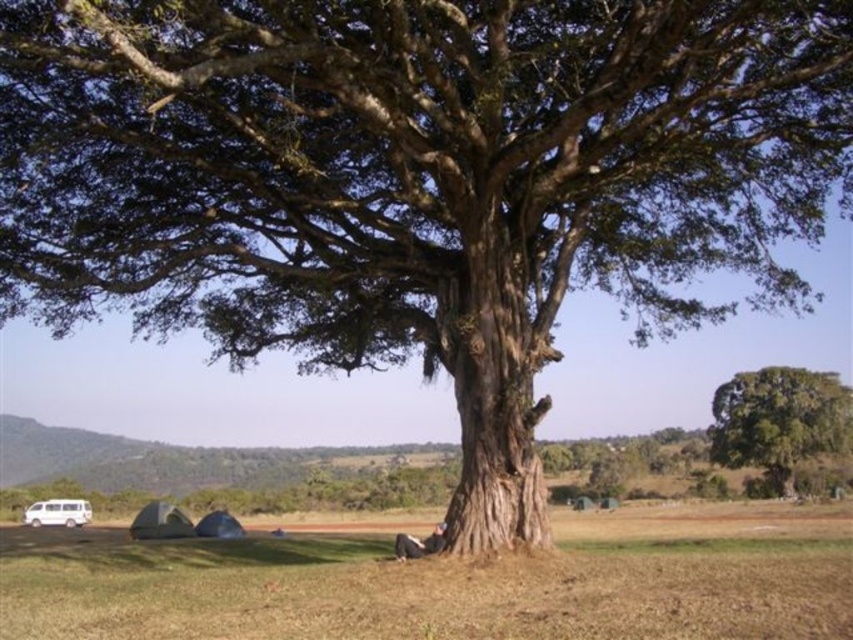
Question: Which point is closer to the camera?

Choices:
 (A) (729, 445)
 (B) (677, 522)
 (C) (51, 500)

Answer: (B)

Question: Is brown grass at lower center positioned before green rough bark tree at upper right?

Choices:
 (A) yes
 (B) no

Answer: (A)

Question: Which of the following is the closest to the observer?

Choices:
 (A) (51, 509)
 (B) (746, 413)
 (C) (601, 560)

Answer: (C)

Question: Based on their relative distances, which object is nearer to the white matte van at lower left?

Choices:
 (A) green rough bark tree at upper right
 (B) brown grass at lower center

Answer: (B)

Question: Does brown grass at lower center come in front of green rough bark tree at upper right?

Choices:
 (A) no
 (B) yes

Answer: (B)

Question: Can you confirm if brown grass at lower center is thinner than green rough bark tree at upper right?

Choices:
 (A) no
 (B) yes

Answer: (A)